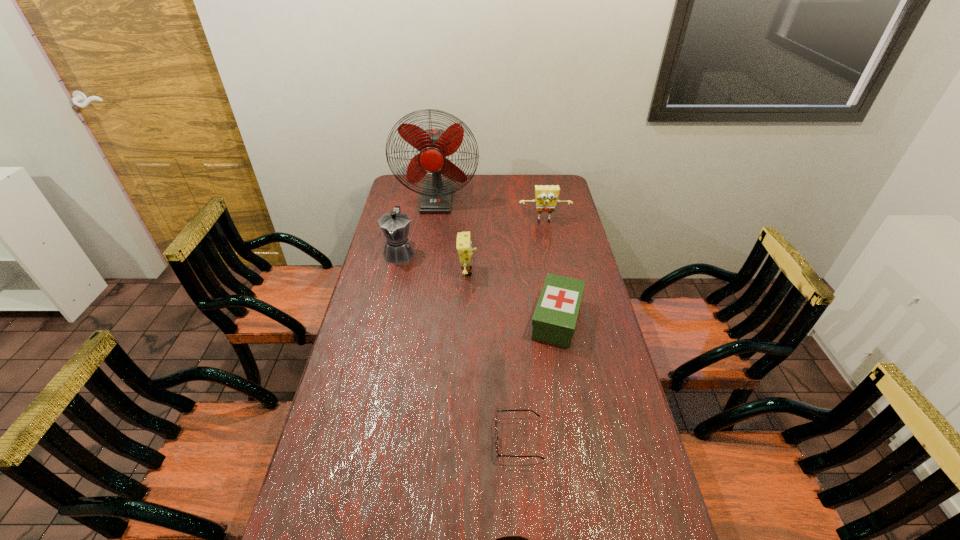
Where is `sponge situated at the right edge`? The width and height of the screenshot is (960, 540). sponge situated at the right edge is located at coordinates (546, 197).

Locate an element on the screen. This screenshot has width=960, height=540. the first-aid kit positioned at the right edge is located at coordinates pos(554,320).

Locate an element on the screen. object present at the far left corner is located at coordinates (434, 145).

At what (x,y) coordinates should I click in order to perform the action: click on free space at the far edge. Please return your answer as a coordinate pair (x, y). Looking at the image, I should click on (510, 176).

Where is `free space at the left edge of the desktop`? The image size is (960, 540). free space at the left edge of the desktop is located at coordinates (321, 533).

You are a GUI agent. You are given a task and a screenshot of the screen. Output one action in this format:
    pyautogui.click(x=<x>, y=<y>)
    Task: Click on the blank space at the right edge
    The height and width of the screenshot is (540, 960).
    Given the screenshot: What is the action you would take?
    pyautogui.click(x=600, y=459)

At what (x,y) coordinates should I click in order to perform the action: click on free space between the second nearest object and the tallest object. Please return your answer as a coordinate pair (x, y). Looking at the image, I should click on (478, 320).

The width and height of the screenshot is (960, 540). What are the coordinates of `vacant point located between the shortest object and the tallest object` in the screenshot? It's located at (478, 320).

This screenshot has height=540, width=960. I want to click on blank region between the right sponge and the spectacles, so click(x=532, y=330).

Where is `free point between the farther sponge and the coffeepot`? This screenshot has height=540, width=960. free point between the farther sponge and the coffeepot is located at coordinates (472, 237).